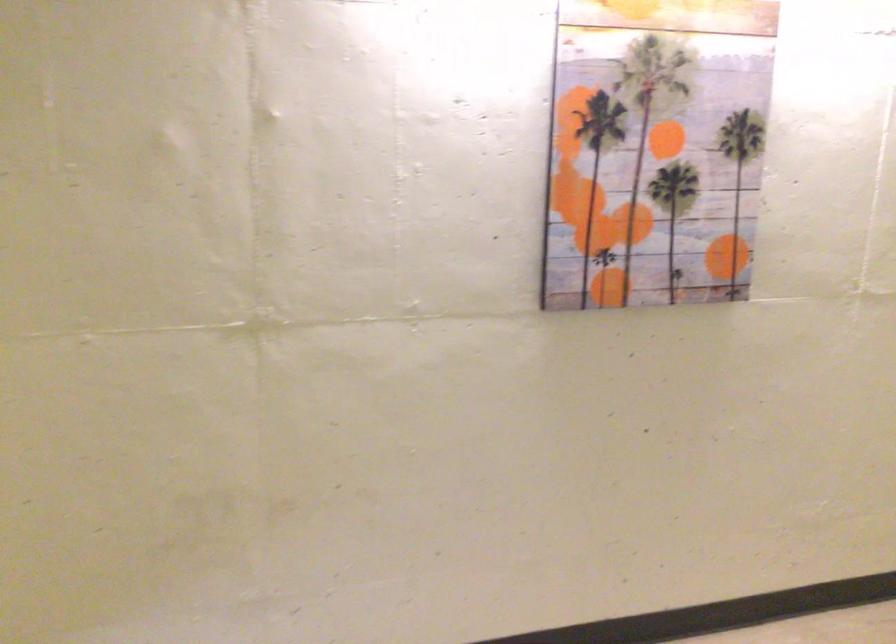
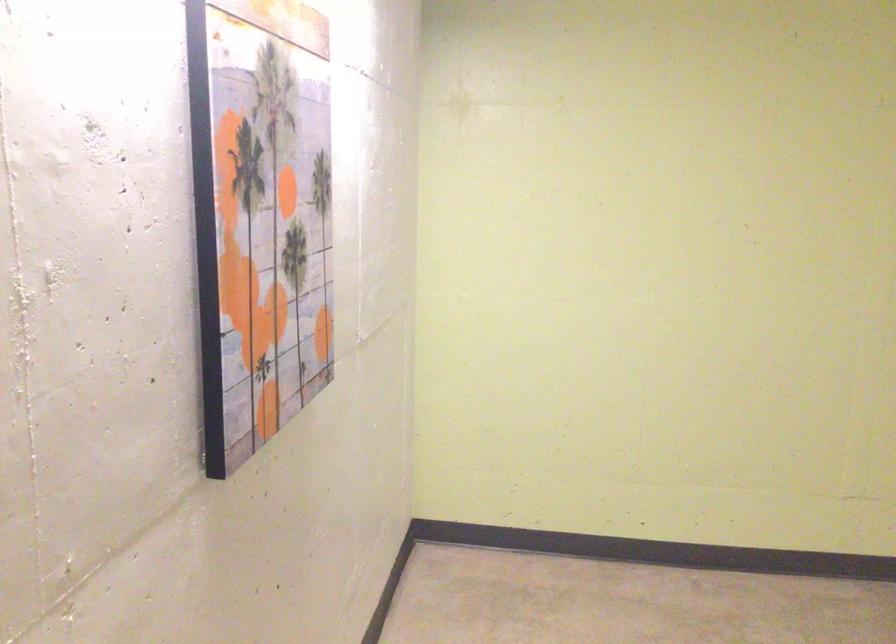
Where in the second image is the point corresponding to (613,160) from the first image?

(260, 216)